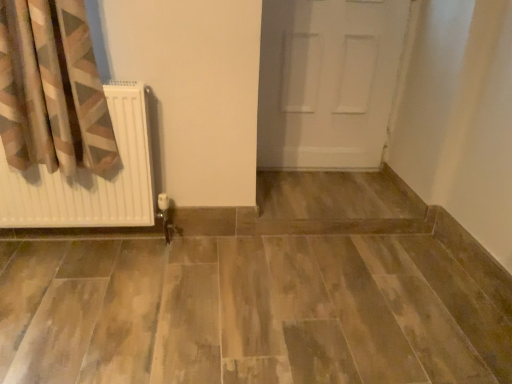
What is the approximate height of white matte door at center?

white matte door at center is 94.26 centimeters tall.

Image resolution: width=512 pixels, height=384 pixels. What do you see at coordinates (327, 81) in the screenshot?
I see `white matte door at center` at bounding box center [327, 81].

The image size is (512, 384). I want to click on white matte door at center, so click(327, 81).

What is the approximate height of white matte radiator at left?

29.07 inches.

Describe the element at coordinates (89, 178) in the screenshot. I see `white matte radiator at left` at that location.

Identify the location of white matte radiator at left. This screenshot has height=384, width=512. (89, 178).

This screenshot has width=512, height=384. I want to click on white matte door at center, so click(327, 81).

Is white matte door at center at the right side of white matte radiator at left?

Yes.

Between white matte door at center and white matte radiator at left, which one is positioned in front?

white matte radiator at left is in front.

Between point (303, 62) and point (68, 212), which one is positioned behind?

The point (303, 62) is farther from the camera.

From the image's perspective, would you say white matte door at center is shown under white matte radiator at left?

Actually, white matte door at center appears above white matte radiator at left in the image.

From a real-world perspective, is white matte door at center physically above white matte radiator at left?

Yes, from a real-world perspective, white matte door at center is above white matte radiator at left.

Between white matte door at center and white matte radiator at left, which one has larger width?

Wider between the two is white matte radiator at left.

Which of these two, white matte door at center or white matte radiator at left, stands shorter?

With less height is white matte radiator at left.

Considering the sizes of objects white matte door at center and white matte radiator at left in the image provided, who is smaller, white matte door at center or white matte radiator at left?

Smaller between the two is white matte radiator at left.

Is white matte radiator at left located within white matte door at center?

No, white matte radiator at left is not a part of white matte door at center.

Is white matte door at center positioned far away from white matte radiator at left?

That's right, there is a large distance between white matte door at center and white matte radiator at left.

Is white matte door at center facing towards white matte radiator at left?

No.

In the image, there is a white matte door at center. Identify the location of radiator below it (from a real-world perspective). The width and height of the screenshot is (512, 384). (89, 178).

Between white matte radiator at left and white matte door at center, which one appears on the right side from the viewer's perspective?

Positioned to the right is white matte door at center.

Considering the relative positions of white matte radiator at left and white matte door at center in the image provided, is white matte radiator at left behind white matte door at center?

No, it is not.

Does point (4, 188) lie behind point (357, 142)?

No, it is in front of (357, 142).

From the image's perspective, which one is positioned lower, white matte radiator at left or white matte door at center?

white matte radiator at left appears lower in the image.

From a real-world perspective, who is located higher, white matte radiator at left or white matte door at center?

From a 3D spatial view, white matte door at center is above.

Consider the image. Does white matte radiator at left have a lesser width compared to white matte door at center?

No, white matte radiator at left is not thinner than white matte door at center.

Who is shorter, white matte radiator at left or white matte door at center?

white matte radiator at left.

In the scene shown: Which of these two, white matte radiator at left or white matte door at center, is smaller?

With smaller size is white matte radiator at left.

Is white matte radiator at left not within white matte door at center?

Indeed, white matte radiator at left is completely outside white matte door at center.

Consider the image. Are white matte radiator at left and white matte door at center beside each other?

white matte radiator at left and white matte door at center are not in contact.

Could you tell me if white matte radiator at left is turned towards white matte door at center?

No, white matte radiator at left is not oriented towards white matte door at center.

You are a GUI agent. You are given a task and a screenshot of the screen. Output one action in this format:
    pyautogui.click(x=<x>, y=<y>)
    Task: Click on the door above the white matte radiator at left (from a real-world perspective)
    The image size is (512, 384).
    Given the screenshot: What is the action you would take?
    pyautogui.click(x=327, y=81)

Where is `radiator below the white matte door at center (from a real-world perspective)`? The height and width of the screenshot is (384, 512). radiator below the white matte door at center (from a real-world perspective) is located at coordinates (89, 178).

Find the location of `radiator on the left of the white matte door at center`. radiator on the left of the white matte door at center is located at coordinates (89, 178).